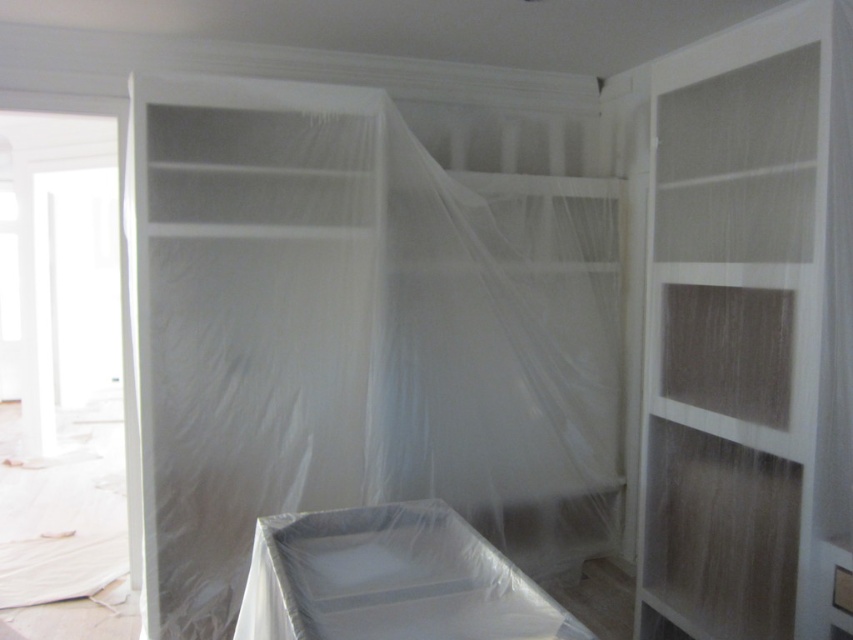
Is transparent plastic curtain at center positioned at the back of white matte wood shelf at center?

That is True.

Is transparent plastic curtain at center wider than white matte wood shelf at center?

Correct, the width of transparent plastic curtain at center exceeds that of white matte wood shelf at center.

This screenshot has width=853, height=640. What do you see at coordinates (357, 336) in the screenshot? I see `transparent plastic curtain at center` at bounding box center [357, 336].

You are a GUI agent. You are given a task and a screenshot of the screen. Output one action in this format:
    pyautogui.click(x=<x>, y=<y>)
    Task: Click on the transparent plastic curtain at center
    The height and width of the screenshot is (640, 853).
    Given the screenshot: What is the action you would take?
    pyautogui.click(x=357, y=336)